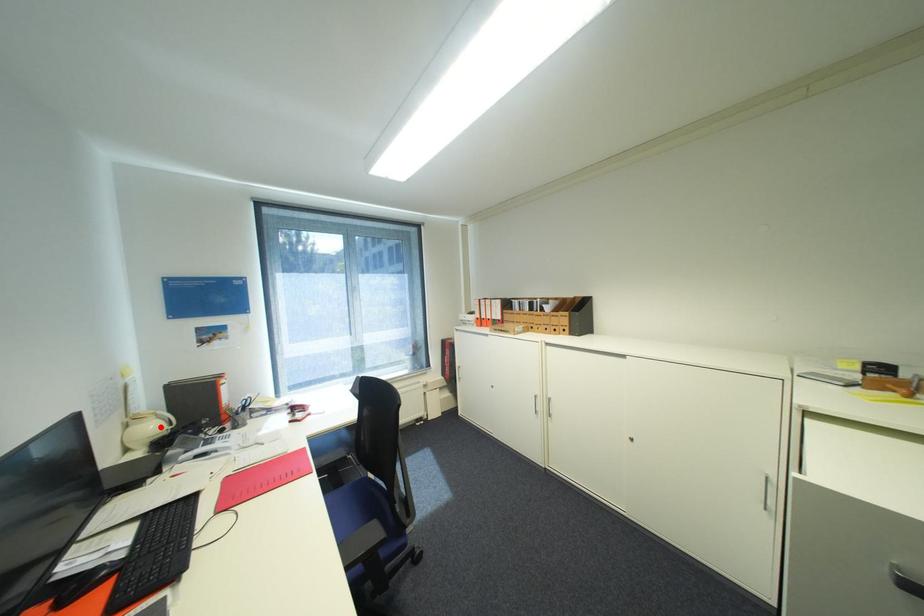
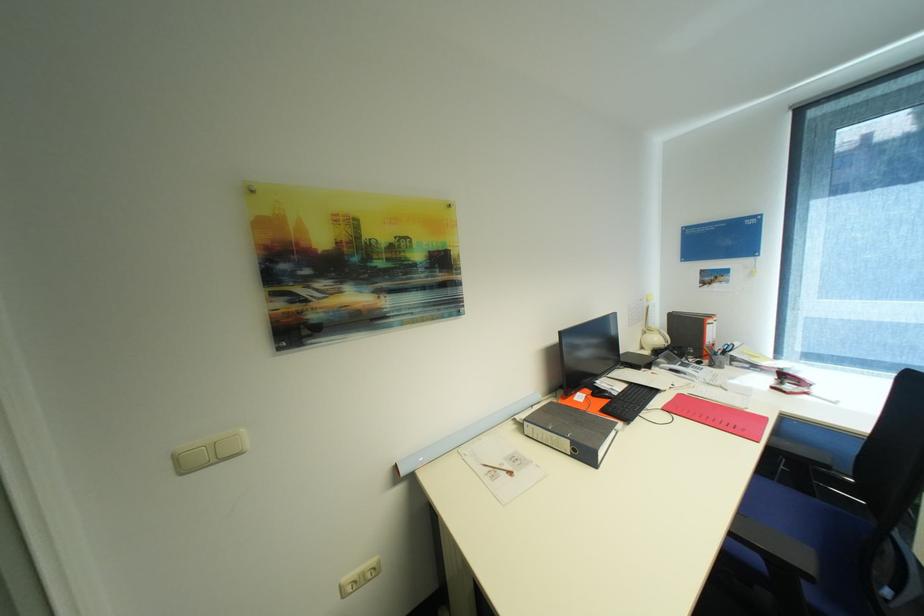
The point at the highlighted location is marked in the first image. Where is the corresponding point in the second image?

(663, 339)